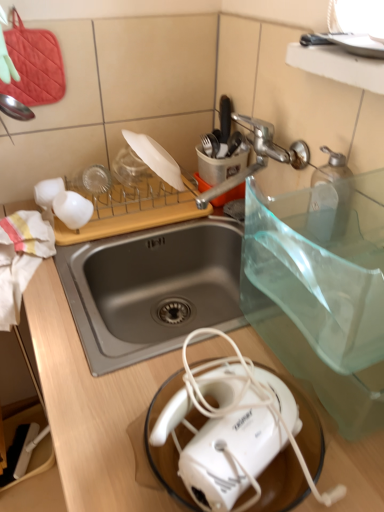
Question: Considering the positions of silver metallic faucet at upper center and white plastic toaster at lower center in the image, is silver metallic faucet at upper center bigger or smaller than white plastic toaster at lower center?

Choices:
 (A) small
 (B) big

Answer: (B)

Question: Is silver metallic faucet at upper center inside or outside of white plastic toaster at lower center?

Choices:
 (A) outside
 (B) inside

Answer: (A)

Question: Which is nearer to the silver metallic faucet at upper center?

Choices:
 (A) white wood cutting board at upper center
 (B) white matte plate at upper center
 (C) white matte coffee cup at upper left
 (D) white plastic toaster at lower center

Answer: (B)

Question: Which of these objects is positioned farthest from the white plastic toaster at lower center?

Choices:
 (A) white matte coffee cup at upper left
 (B) white matte plate at upper center
 (C) white wood cutting board at upper center
 (D) silver metallic faucet at upper center

Answer: (B)